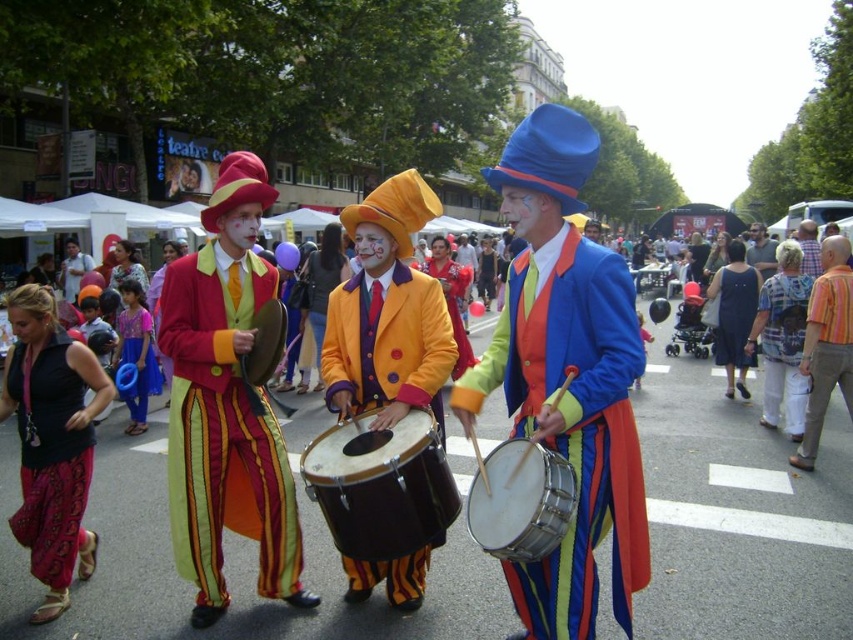
Question: Based on their relative distances, which object is nearer to the matte black dress at center?

Choices:
 (A) shiny blue fabric coat at center
 (B) patterned fabric pants at lower left

Answer: (A)

Question: Which point appears closest to the camera in this image?

Choices:
 (A) (236, 337)
 (B) (837, 371)
 (C) (567, 337)

Answer: (C)

Question: Does shiny blue fabric coat at center lie in front of matte yellow vest at center?

Choices:
 (A) yes
 (B) no

Answer: (A)

Question: Is striped cotton shirt at center to the right of smooth brown leather jacket at center from the viewer's perspective?

Choices:
 (A) yes
 (B) no

Answer: (B)

Question: Can you confirm if shiny blue fabric coat at center is positioned to the left of striped cotton shirt at center?

Choices:
 (A) no
 (B) yes

Answer: (B)

Question: Estimate the real-world distances between objects in this image. Which object is closer to the shiny blue fabric coat at center?

Choices:
 (A) striped cotton shirt at center
 (B) patterned fabric shirt at center
 (C) striped shirt at center

Answer: (A)